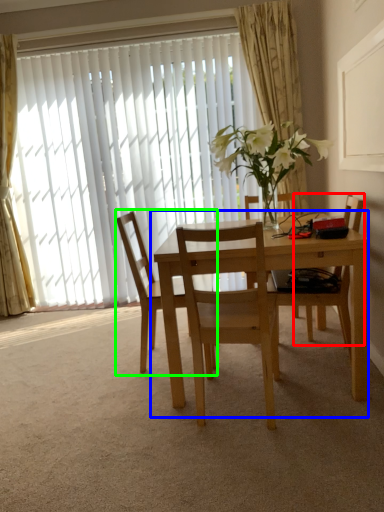
Question: Considering the real-world distances, which object is farthest from chair (highlighted by a red box)? kitchen & dining room table (highlighted by a blue box) or chair (highlighted by a green box)?

Choices:
 (A) kitchen & dining room table
 (B) chair

Answer: (B)